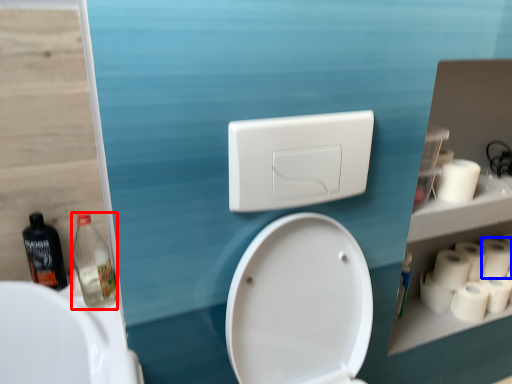
Question: Which of the following is the farthest to the observer, bottle (highlighted by a red box) or toilet paper (highlighted by a blue box)?

Choices:
 (A) bottle
 (B) toilet paper

Answer: (B)